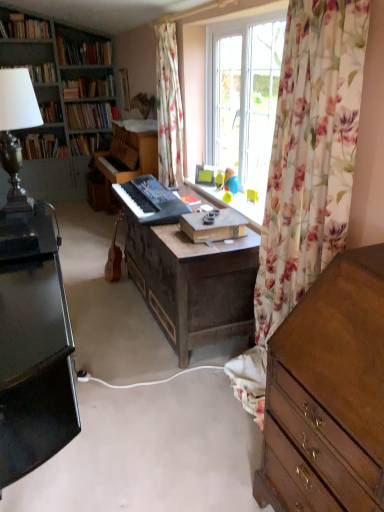
Question: From the image's perspective, is metallic silver lampshade at upper left below wooden bookcase at left?

Choices:
 (A) yes
 (B) no

Answer: (A)

Question: Is wooden bookcase at left a part of metallic silver lampshade at upper left?

Choices:
 (A) yes
 (B) no

Answer: (B)

Question: Considering the relative positions of metallic silver lampshade at upper left and wooden bookcase at left in the image provided, is metallic silver lampshade at upper left behind wooden bookcase at left?

Choices:
 (A) yes
 (B) no

Answer: (B)

Question: Can you confirm if metallic silver lampshade at upper left is positioned to the left of wooden bookcase at left?

Choices:
 (A) no
 (B) yes

Answer: (A)

Question: Can you confirm if metallic silver lampshade at upper left is taller than wooden bookcase at left?

Choices:
 (A) yes
 (B) no

Answer: (B)

Question: In the image, is floral fabric curtain at right, which is counted as the second curtain, starting from the back, positioned in front of or behind wooden desk at center?

Choices:
 (A) behind
 (B) front

Answer: (B)

Question: From a real-world perspective, relative to wooden desk at center, is floral fabric curtain at right, which is counted as the second curtain, starting from the back, vertically above or below?

Choices:
 (A) above
 (B) below

Answer: (A)

Question: From the image's perspective, relative to wooden desk at center, is floral fabric curtain at right, the 1th curtain viewed from the front, above or below?

Choices:
 (A) above
 (B) below

Answer: (A)

Question: Would you say floral fabric curtain at right, which is the first curtain from right to left, is to the left or to the right of wooden desk at center in the picture?

Choices:
 (A) left
 (B) right

Answer: (B)

Question: From the image's perspective, is hardcover books at upper left, which ranks as the 2th book in top-to-bottom order, positioned above or below floral fabric curtain at center, which is the 2th curtain in front-to-back order?

Choices:
 (A) below
 (B) above

Answer: (B)

Question: Looking at their shapes, would you say hardcover books at upper left, which ranks as the 2th book in top-to-bottom order, is wider or thinner than floral fabric curtain at center, placed as the 1th curtain when sorted from left to right?

Choices:
 (A) wide
 (B) thin

Answer: (A)

Question: From their relative heights in the image, would you say hardcover books at upper left, which ranks as the 2th book in top-to-bottom order, is taller or shorter than floral fabric curtain at center, which is the 2th curtain in front-to-back order?

Choices:
 (A) short
 (B) tall

Answer: (A)

Question: In terms of size, does hardcover books at upper left, acting as the sixth book starting from the bottom, appear bigger or smaller than floral fabric curtain at center, which is the 2th curtain in front-to-back order?

Choices:
 (A) big
 (B) small

Answer: (B)

Question: Is wooden chest of drawers at right situated inside brown wooden guitar at center or outside?

Choices:
 (A) outside
 (B) inside

Answer: (A)

Question: Considering the relative positions of wooden chest of drawers at right and brown wooden guitar at center in the image provided, is wooden chest of drawers at right to the left or to the right of brown wooden guitar at center?

Choices:
 (A) right
 (B) left

Answer: (A)